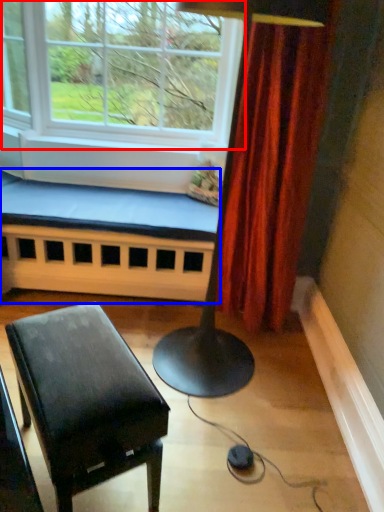
Question: Among these objects, which one is farthest to the camera, window (highlighted by a red box) or church bench (highlighted by a blue box)?

Choices:
 (A) window
 (B) church bench

Answer: (B)